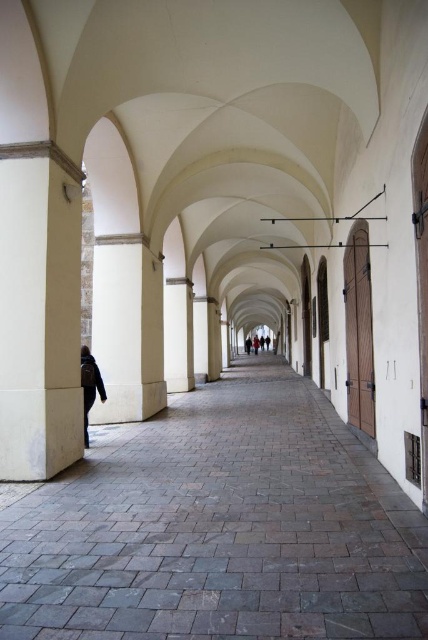
Question: Can you confirm if gray stone path at center is wider than light brown leather shoes at center?

Choices:
 (A) no
 (B) yes

Answer: (B)

Question: Can you confirm if dark gray fabric jacket at center is thinner than light brown leather shoes at center?

Choices:
 (A) no
 (B) yes

Answer: (B)

Question: Is gray stone path at center thinner than dark gray fabric jacket at center?

Choices:
 (A) no
 (B) yes

Answer: (A)

Question: Which object appears farthest from the camera in this image?

Choices:
 (A) gray stone path at center
 (B) light brown leather shoes at center

Answer: (B)

Question: Among these objects, which one is farthest from the camera?

Choices:
 (A) gray stone path at center
 (B) dark gray fabric jacket at center

Answer: (B)

Question: Which object is positioned farthest from the light brown leather shoes at center?

Choices:
 (A) gray stone path at center
 (B) dark gray fabric jacket at center

Answer: (B)